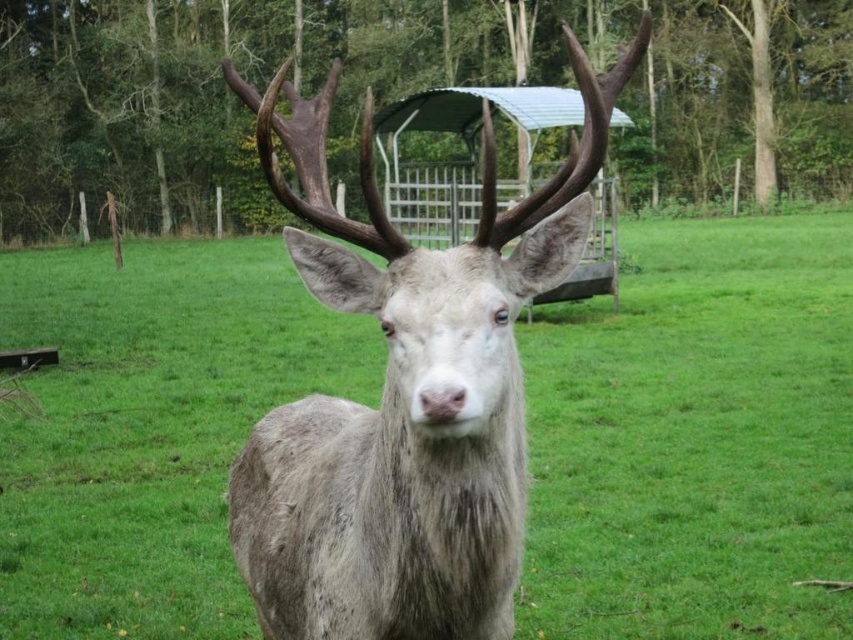
You are a photographer trying to capture the fuzzy gray deer at center. You notice there is green grassy at center in the foreground. Will the deer be fully visible in your photo if you focus on the deer?

The fuzzy gray deer at center is behind the green grassy at center, so focusing on the deer may cause the grass to appear slightly out of focus, but the deer should still be mostly visible.

You are a photographer trying to capture the fuzzy gray deer at center in the image. You want to ensure the deer is clearly visible against the green grassy at center. Based on the scene description, will the deer be easy to see against the grass? Explain why or why not.

The green grassy at center is taller than fuzzy gray deer at center, so the deer may be partially obscured by the tall grass, making it harder to see clearly against the grassy background.